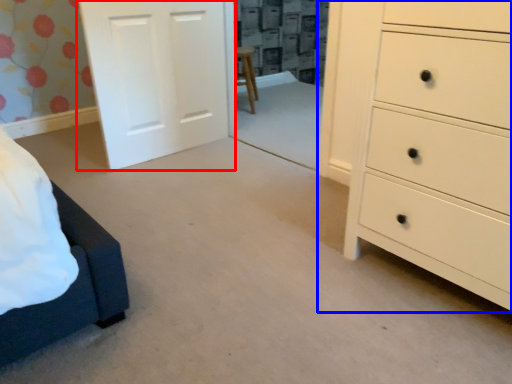
Question: Among these objects, which one is nearest to the camera, door (highlighted by a red box) or chest of drawers (highlighted by a blue box)?

Choices:
 (A) door
 (B) chest of drawers

Answer: (B)